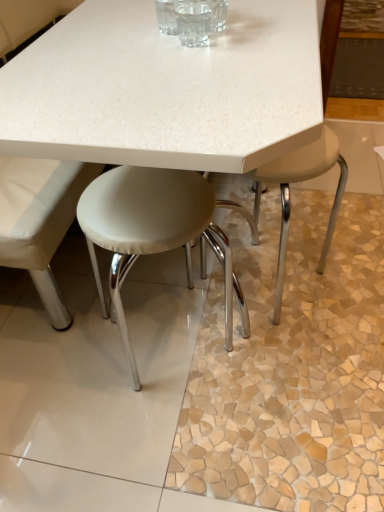
Where is `vacant area that lies between beige leather stool at lower right, acting as the second stool starting from the left, and white leather stool at center, which is the 1th stool in left-to-right order`? The height and width of the screenshot is (512, 384). vacant area that lies between beige leather stool at lower right, acting as the second stool starting from the left, and white leather stool at center, which is the 1th stool in left-to-right order is located at coordinates (235, 326).